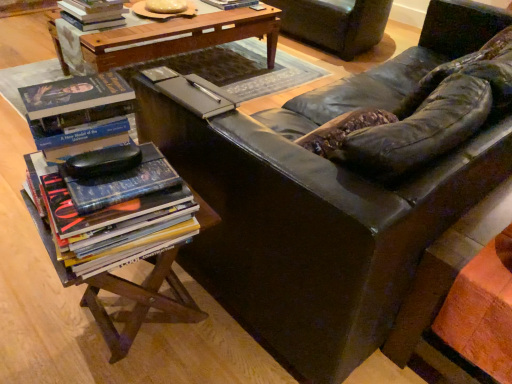
Question: From a real-world perspective, is hardcover book at upper left, which is the second book in bottom-to-top order, physically located above or below velvet dark brown armchair at upper center?

Choices:
 (A) above
 (B) below

Answer: (A)

Question: Is hardcover book at upper left, which is the 2th book from back to front, bigger or smaller than velvet dark brown armchair at upper center?

Choices:
 (A) big
 (B) small

Answer: (B)

Question: Based on their relative distances, which object is nearer to the velvet dark brown armchair at upper center?

Choices:
 (A) matte brown book at center
 (B) matte black leather couch at center
 (C) woodenmaterial/texturetable at lower left, marked as the 2th table in a top-to-bottom arrangement
 (D) wooden table at center, which is the 1th table from back to front
 (E) hardcover book at upper center, which is counted as the 3th book, starting from the front

Answer: (E)

Question: Based on their relative distances, which object is farther from the hardcover book at upper left, positioned as the second book in top-to-bottom order?

Choices:
 (A) woodenmaterial/texturetable at lower left, the first table in the bottom-to-top sequence
 (B) hardcover book at upper center, arranged as the first book when viewed from the top
 (C) velvet dark brown armchair at upper center
 (D) matte black leather couch at center
 (E) matte brown book at center

Answer: (A)